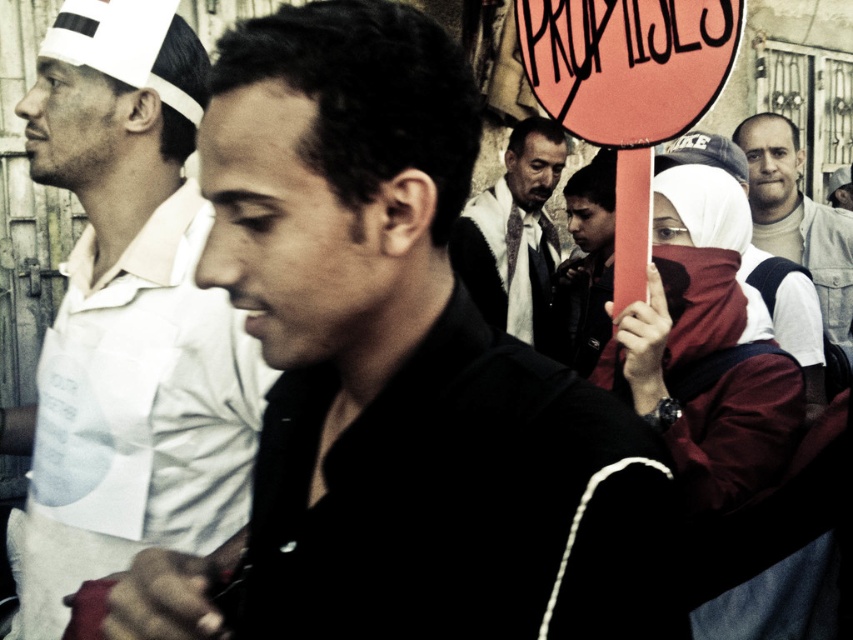
Question: Which point is closer to the camera taking this photo?

Choices:
 (A) (550, 317)
 (B) (525, 259)
 (C) (374, 579)

Answer: (C)

Question: Can you confirm if matte red scarf at center is smaller than dark brown leather jacket at center?

Choices:
 (A) no
 (B) yes

Answer: (B)

Question: Which object is the closest to the light brown leather jacket at upper right?

Choices:
 (A) matte red scarf at center
 (B) black matte shirt at center
 (C) matte white shirt at center

Answer: (C)

Question: Does white cotton shirt at left have a greater width compared to light brown leather jacket at upper right?

Choices:
 (A) no
 (B) yes

Answer: (B)

Question: Among these objects, which one is farthest from the camera?

Choices:
 (A) white cotton shirt at left
 (B) dark brown leather jacket at center
 (C) matte red scarf at center
 (D) matte white shirt at center

Answer: (D)

Question: Is black matte shirt at center below light brown leather jacket at upper right?

Choices:
 (A) no
 (B) yes

Answer: (B)